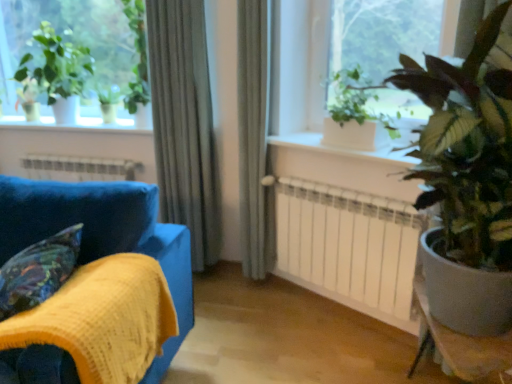
Measure the distance between point (374, 245) and camera.

A distance of 6.88 feet exists between point (374, 245) and camera.

Measure the distance between smooth gray table at lower right and camera.

The depth of smooth gray table at lower right is 1.27 meters.

The image size is (512, 384). What do you see at coordinates (460, 344) in the screenshot?
I see `smooth gray table at lower right` at bounding box center [460, 344].

Measure the distance between point (207, 107) and camera.

Point (207, 107) is 8.43 feet away from camera.

Measure the distance between satin fabric curtain at center, positioned as the first curtain in right-to-left order, and camera.

A distance of 7.09 feet exists between satin fabric curtain at center, positioned as the first curtain in right-to-left order, and camera.

Describe the element at coordinates (254, 140) in the screenshot. I see `satin fabric curtain at center, the 2th curtain in the left-to-right sequence` at that location.

The height and width of the screenshot is (384, 512). What do you see at coordinates (389, 33) in the screenshot?
I see `green leafy plant at upper right` at bounding box center [389, 33].

Describe the element at coordinates (78, 168) in the screenshot. I see `white metallic heater at lower center` at that location.

Find the location of a particular element. The height and width of the screenshot is (384, 512). white matte radiator at center is located at coordinates (348, 246).

Is green matte plant at upper right, placed as the second houseplant when sorted from front to back, not near velvet blue sofa at lower left?

Yes.

Does green matte plant at upper right, which is the second houseplant from back to front, have a lesser width compared to velvet blue sofa at lower left?

Indeed, green matte plant at upper right, which is the second houseplant from back to front, has a lesser width compared to velvet blue sofa at lower left.

Considering the positions of objects green matte plant at upper right, placed as the second houseplant when sorted from left to right, and velvet blue sofa at lower left in the image provided, who is more to the left, green matte plant at upper right, placed as the second houseplant when sorted from left to right, or velvet blue sofa at lower left?

From the viewer's perspective, velvet blue sofa at lower left appears more on the left side.

From the image's perspective, relative to velvet blue sofa at lower left, is green matte plant at upper right, placed as the second houseplant when sorted from left to right, above or below?

green matte plant at upper right, placed as the second houseplant when sorted from left to right, is situated higher than velvet blue sofa at lower left in the image.

Which is more to the left, white smooth window sill at center or velvet blue sofa at lower left?

velvet blue sofa at lower left is more to the left.

From their relative heights in the image, would you say white smooth window sill at center is taller or shorter than velvet blue sofa at lower left?

white smooth window sill at center is shorter than velvet blue sofa at lower left.

Which of these two, white smooth window sill at center or velvet blue sofa at lower left, is thinner?

With smaller width is white smooth window sill at center.

Does white smooth window sill at center have a smaller size compared to velvet blue sofa at lower left?

Correct, white smooth window sill at center occupies less space than velvet blue sofa at lower left.

Does silky gray curtain at center, placed as the 1th curtain when sorted from left to right, have a greater width compared to velvet blue sofa at lower left?

No.

In the scene shown: Can you tell me how much silky gray curtain at center, placed as the 1th curtain when sorted from left to right, and velvet blue sofa at lower left differ in facing direction?

The angle between the facing direction of silky gray curtain at center, placed as the 1th curtain when sorted from left to right, and the facing direction of velvet blue sofa at lower left is 0.79 degrees.

Is silky gray curtain at center, which is counted as the second curtain, starting from the right, spatially inside velvet blue sofa at lower left, or outside of it?

silky gray curtain at center, which is counted as the second curtain, starting from the right, is not enclosed by velvet blue sofa at lower left.

Is silky gray curtain at center, which is counted as the second curtain, starting from the right, taller or shorter than velvet blue sofa at lower left?

In the image, silky gray curtain at center, which is counted as the second curtain, starting from the right, appears to be taller than velvet blue sofa at lower left.

From the image's perspective, would you say velvet-like multicolored pillow at lower left is shown under green glossy plant at right, the third houseplant viewed from the back?

Correct, velvet-like multicolored pillow at lower left appears lower than green glossy plant at right, the third houseplant viewed from the back, in the image.

Which of these two, velvet-like multicolored pillow at lower left or green glossy plant at right, which ranks as the 1th houseplant in right-to-left order, is smaller?

With smaller size is velvet-like multicolored pillow at lower left.

Is velvet-like multicolored pillow at lower left thinner than green glossy plant at right, the third houseplant viewed from the back?

Yes.

Which is correct: green matte plant at upper left, arranged as the third houseplant when viewed from the front, is inside satin fabric curtain at center, positioned as the first curtain in right-to-left order, or outside of it?

green matte plant at upper left, arranged as the third houseplant when viewed from the front, cannot be found inside satin fabric curtain at center, positioned as the first curtain in right-to-left order.

The width and height of the screenshot is (512, 384). In order to click on the 2nd houseplant above the satin fabric curtain at center, the 2th curtain in the left-to-right sequence (from the image's perspective) in this screenshot , I will do `click(55, 73)`.

Is green matte plant at upper left, arranged as the third houseplant when viewed from the front, shorter than satin fabric curtain at center, positioned as the first curtain in right-to-left order?

Yes, green matte plant at upper left, arranged as the third houseplant when viewed from the front, is shorter than satin fabric curtain at center, positioned as the first curtain in right-to-left order.

From the image's perspective, is white matte radiator at center over white smooth window sill at center?

No.

Looking at their sizes, would you say white matte radiator at center is wider or thinner than white smooth window sill at center?

white matte radiator at center is thinner than white smooth window sill at center.

Where is `window sill on the right of white matte radiator at center`? This screenshot has height=384, width=512. window sill on the right of white matte radiator at center is located at coordinates (343, 149).

Which of these two, white matte radiator at center or white smooth window sill at center, is bigger?

white matte radiator at center is bigger.

Considering the sizes of green leafy plant at upper right and white smooth window sill at center in the image, is green leafy plant at upper right wider or thinner than white smooth window sill at center?

Clearly, green leafy plant at upper right has less width compared to white smooth window sill at center.

Can you confirm if green leafy plant at upper right is taller than white smooth window sill at center?

Correct, green leafy plant at upper right is much taller as white smooth window sill at center.

How distant is green leafy plant at upper right from white smooth window sill at center?

17.96 inches.

There is a velvet blue sofa at lower left. Where is `the 2nd houseplant above it (from the image's perspective)`? the 2nd houseplant above it (from the image's perspective) is located at coordinates (356, 114).

This screenshot has height=384, width=512. What are the coordinates of `window sill above the velvet blue sofa at lower left (from a real-world perspective)` in the screenshot? It's located at (343, 149).

From the picture: Looking at the image, which one is located closer to green matte plant at upper left, which is counted as the 1th houseplant, starting from the left, green matte plant at upper right, the 2th houseplant in the right-to-left sequence, or white metallic heater at lower center?

Among the two, white metallic heater at lower center is located nearer to green matte plant at upper left, which is counted as the 1th houseplant, starting from the left.

Considering their positions, is green leafy plant at upper right positioned closer to velvet-like multicolored pillow at lower left than green matte plant at upper right, placed as the second houseplant when sorted from front to back?

green matte plant at upper right, placed as the second houseplant when sorted from front to back, lies closer to velvet-like multicolored pillow at lower left than the other object.

From the image, which object appears to be farther from white matte radiator at center, velvet blue sofa at lower left or green glossy plant at right, the first houseplant positioned from the front?

velvet blue sofa at lower left lies further to white matte radiator at center than the other object.

Based on their spatial positions, is white metallic heater at lower center or silky gray curtain at center, placed as the 1th curtain when sorted from left to right, closer to green leafy plant at upper right?

silky gray curtain at center, placed as the 1th curtain when sorted from left to right, is closer to green leafy plant at upper right.

From the image, which object appears to be farther from white smooth window sill at center, velvet blue sofa at lower left or velvet-like multicolored pillow at lower left?

Based on the image, velvet-like multicolored pillow at lower left appears to be further to white smooth window sill at center.

Considering their positions, is white matte radiator at center positioned closer to white smooth window sill at center than smooth gray table at lower right?

white matte radiator at center lies closer to white smooth window sill at center than the other object.

Considering their positions, is green leafy plant at upper right positioned further to green matte plant at upper right, placed as the second houseplant when sorted from front to back, than green matte plant at upper left, arranged as the third houseplant when viewed from the front?

green matte plant at upper left, arranged as the third houseplant when viewed from the front, is positioned further to the anchor green matte plant at upper right, placed as the second houseplant when sorted from front to back.

Estimate the real-world distances between objects in this image. Which object is closer to satin fabric curtain at center, positioned as the first curtain in right-to-left order, green leafy plant at upper right or green matte plant at upper right, placed as the second houseplant when sorted from left to right?

Among the two, green matte plant at upper right, placed as the second houseplant when sorted from left to right, is located nearer to satin fabric curtain at center, positioned as the first curtain in right-to-left order.

What are the coordinates of `window sill between velvet blue sofa at lower left and green leafy plant at upper right` in the screenshot? It's located at (343, 149).

The image size is (512, 384). What are the coordinates of `window screen between velvet blue sofa at lower left and smooth gray table at lower right from left to right` in the screenshot? It's located at (389, 33).

The image size is (512, 384). I want to click on window sill between green matte plant at upper left, arranged as the third houseplant when viewed from the front, and green leafy plant at upper right, so click(343, 149).

The height and width of the screenshot is (384, 512). Identify the location of pillow between green matte plant at upper left, the first houseplant in the back-to-front sequence, and white matte radiator at center. coord(38,271).